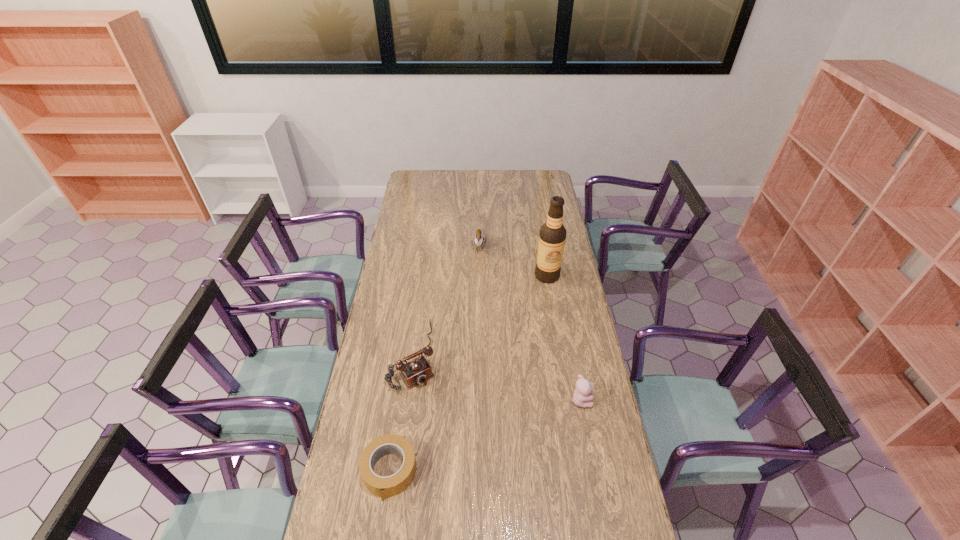
This screenshot has width=960, height=540. Identify the location of teddy bear present at the right edge. (581, 397).

Identify the location of alcohol present at the right edge. (552, 235).

Where is `vacant space at the far edge of the desktop`? This screenshot has height=540, width=960. vacant space at the far edge of the desktop is located at coordinates (485, 173).

In the image, there is a desktop. In order to click on vacant space at the left edge in this screenshot , I will do `click(397, 277)`.

Locate an element on the screen. This screenshot has height=540, width=960. free space at the right edge of the desktop is located at coordinates (570, 408).

Identify the location of free space at the far right corner of the desktop. (542, 187).

Locate an element on the screen. This screenshot has height=540, width=960. free area in between the alcohol and the duct tape is located at coordinates (468, 374).

In order to click on vacant area that lies between the tallest object and the duct tape in this screenshot , I will do `click(468, 374)`.

Image resolution: width=960 pixels, height=540 pixels. In order to click on vacant area that lies between the telephone and the nearest object in this screenshot , I will do pos(401,413).

The image size is (960, 540). I want to click on free space between the telephone and the second farthest object, so (x=480, y=315).